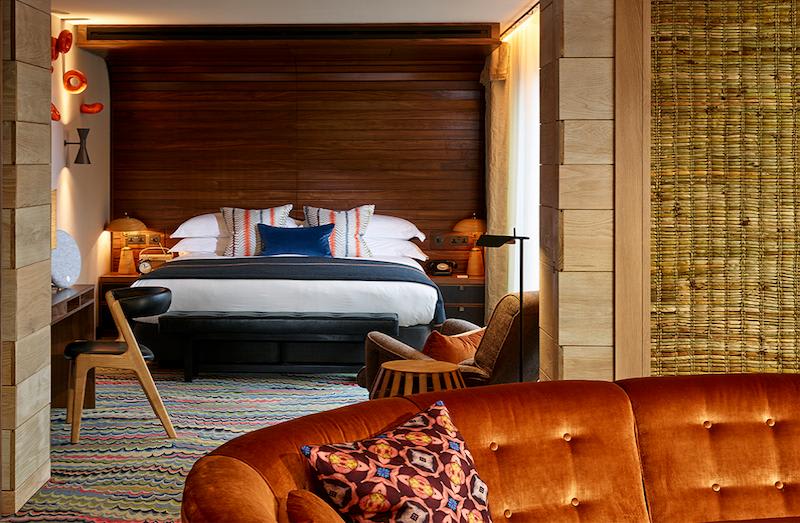
Locate an element on the screen. wooden chair is located at coordinates (129, 360).